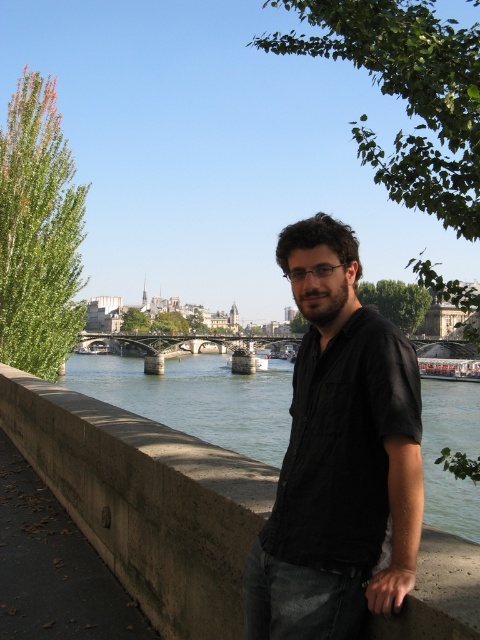
Question: Among these objects, which one is farthest from the camera?

Choices:
 (A) black matte shirt at center
 (B) concrete ledge at center
 (C) concrete bridge at center

Answer: (C)

Question: Which point is farther to the camera?

Choices:
 (A) (173, 561)
 (B) (204, 346)

Answer: (B)

Question: Among these points, which one is farthest from the camera?

Choices:
 (A) (214, 570)
 (B) (310, 278)

Answer: (B)

Question: Can you confirm if black matte shirt at center is positioned to the right of concrete bridge at center?

Choices:
 (A) no
 (B) yes

Answer: (B)

Question: Can you confirm if black matte shirt at center is wider than concrete ledge at center?

Choices:
 (A) no
 (B) yes

Answer: (A)

Question: Is black matte shirt at center above concrete bridge at center?

Choices:
 (A) no
 (B) yes

Answer: (B)